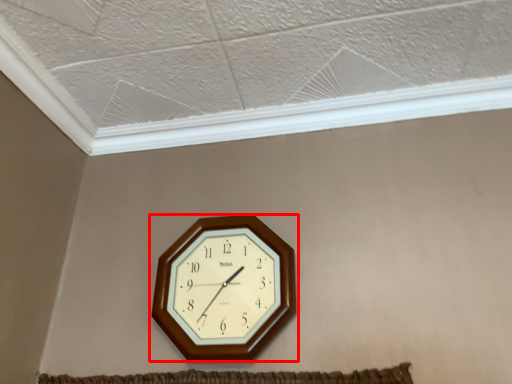
Question: Observing the image, what is the correct spatial positioning of wall clock (annotated by the red box) in reference to window frame?

Choices:
 (A) right
 (B) left

Answer: (B)